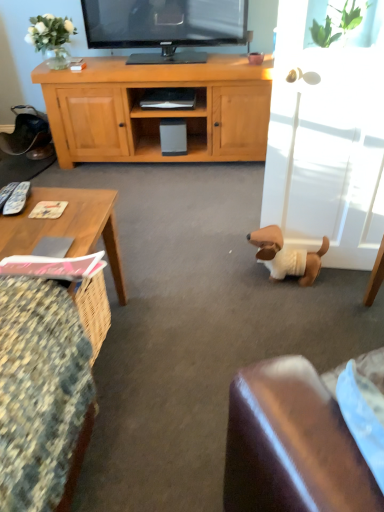
Identify the location of unoccupied region to the right of white plush dog at lower right. This screenshot has height=512, width=384. [347, 286].